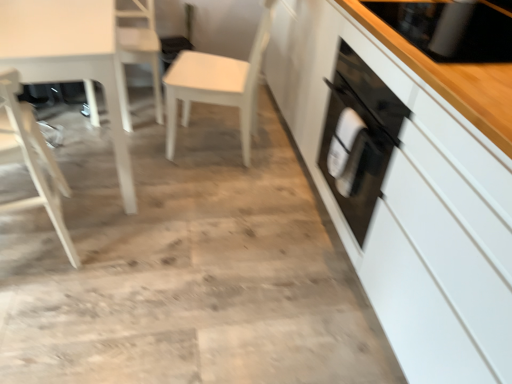
Image resolution: width=512 pixels, height=384 pixels. I want to click on free space in front of white matte chair at center, which is the third chair in left-to-right order, so click(x=226, y=193).